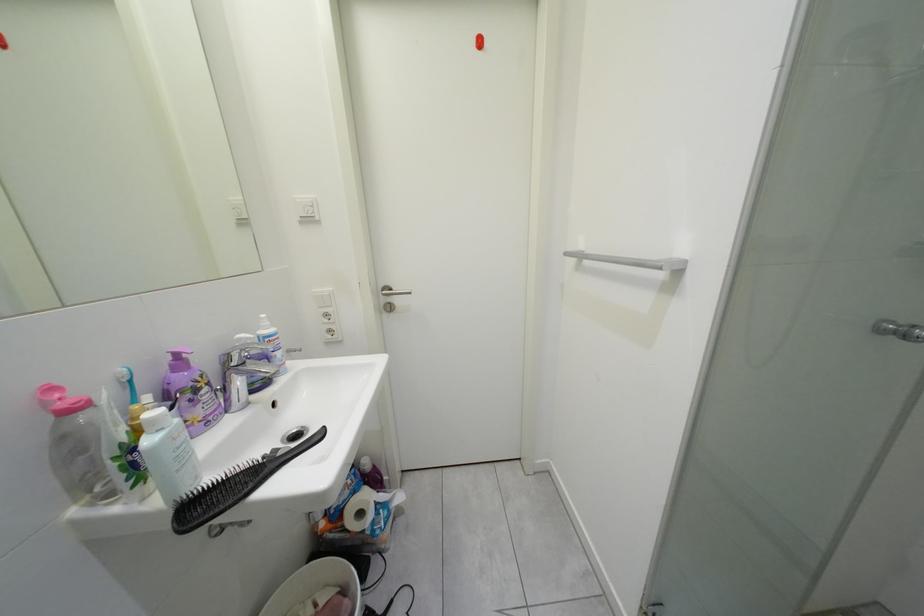
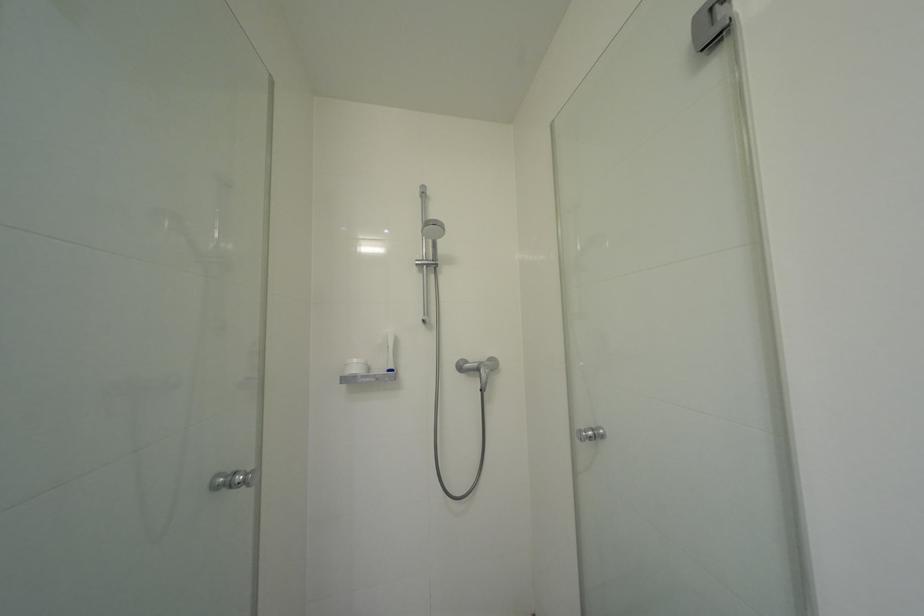
Question: The camera is either moving clockwise (left) or counter-clockwise (right) around the object. The first image is from the beginning of the video and the second image is from the end. Is the camera moving left or right when shooting the video?

Choices:
 (A) Left
 (B) Right

Answer: (A)